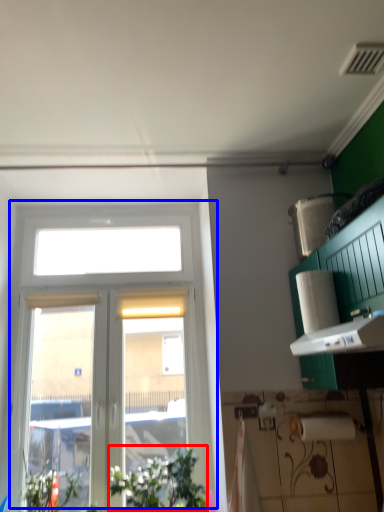
Question: Which object appears farthest to the camera in this image, plant (highlighted by a red box) or window (highlighted by a blue box)?

Choices:
 (A) plant
 (B) window

Answer: (B)